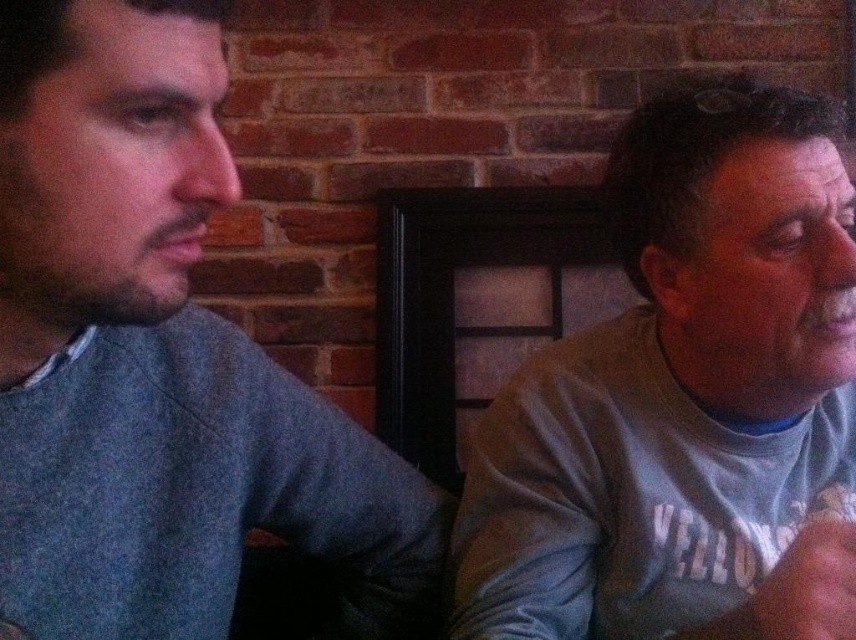
Who is positioned more to the right, gray cotton shirt at left or gray cotton shirt at right?

From the viewer's perspective, gray cotton shirt at right appears more on the right side.

This screenshot has height=640, width=856. What do you see at coordinates (156, 355) in the screenshot? I see `gray cotton shirt at left` at bounding box center [156, 355].

Find the location of `gray cotton shirt at left`. gray cotton shirt at left is located at coordinates (156, 355).